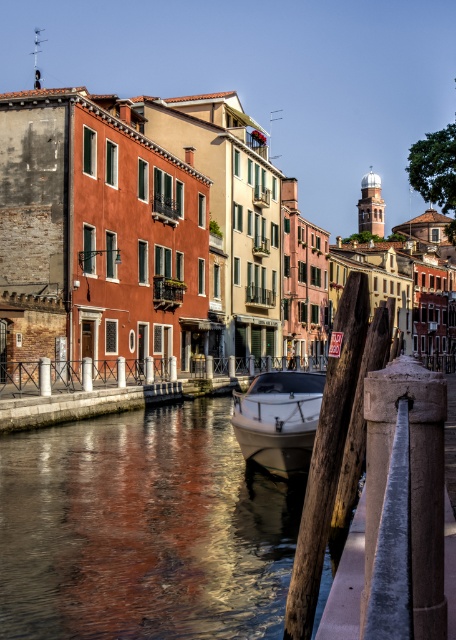
Question: Is glossy water at center bigger than white glossy boat at center?

Choices:
 (A) yes
 (B) no

Answer: (A)

Question: Can you confirm if glossy water at center is positioned to the right of smooth white railing at center?

Choices:
 (A) no
 (B) yes

Answer: (A)

Question: Which point is farther to the camera?

Choices:
 (A) white glossy boat at center
 (B) glossy water at center

Answer: (A)

Question: Which object is positioned closest to the white glossy boat at center?

Choices:
 (A) glossy water at center
 (B) smooth white railing at center

Answer: (A)

Question: Is glossy water at center to the left of smooth white railing at center from the viewer's perspective?

Choices:
 (A) no
 (B) yes

Answer: (B)

Question: Which object is the closest to the smooth white railing at center?

Choices:
 (A) glossy water at center
 (B) white glossy boat at center

Answer: (A)